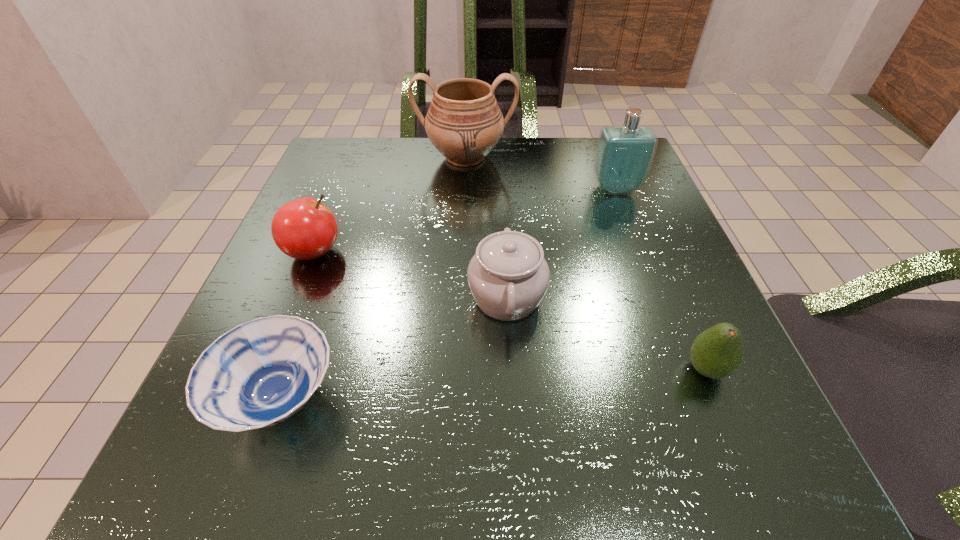
You are a GUI agent. You are given a task and a screenshot of the screen. Output one action in this format:
    pyautogui.click(x=<x>, y=<y>)
    Task: Click on the object located in the far right corner section of the desktop
    This screenshot has height=540, width=960.
    Given the screenshot: What is the action you would take?
    pyautogui.click(x=624, y=155)

At what (x,y) coordinates should I click in order to perform the action: click on free point at the far edge. Please return your answer as a coordinate pair (x, y). The height and width of the screenshot is (540, 960). Looking at the image, I should click on (427, 173).

Locate an element on the screen. The width and height of the screenshot is (960, 540). vacant area at the near edge of the desktop is located at coordinates (541, 451).

Identify the location of free spot at the right edge of the desktop. (619, 280).

You are a GUI agent. You are given a task and a screenshot of the screen. Output one action in this format:
    pyautogui.click(x=<x>, y=<y>)
    Task: Click on the vacant region at the far left corner of the desktop
    The height and width of the screenshot is (540, 960).
    Given the screenshot: What is the action you would take?
    pyautogui.click(x=386, y=177)

The image size is (960, 540). In the image, there is a desktop. Identify the location of free space at the far right corner. (589, 142).

Where is `free location at the near right corner`? free location at the near right corner is located at coordinates (x=675, y=440).

What are the coordinates of `free space between the farthest object and the apple` in the screenshot? It's located at (390, 205).

Find the location of a particular element. empty location between the second farthest object and the avocado is located at coordinates (661, 279).

Find the location of a particular element. The image size is (960, 540). free area in between the urn and the soup bowl is located at coordinates (372, 278).